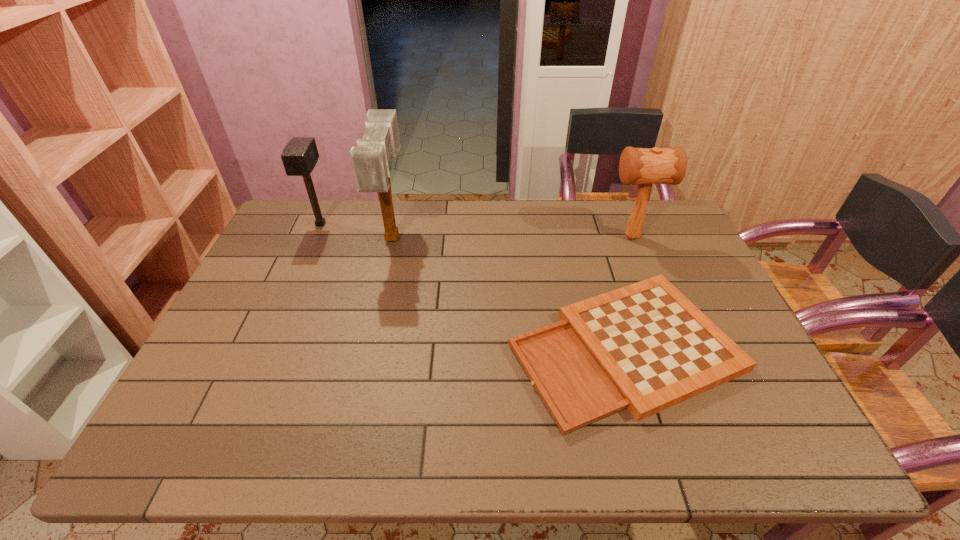
This screenshot has width=960, height=540. Identify the location of vacant area situated 0.320m on the right of the leftmost object. (423, 224).

Locate an element on the screen. free region located on the back of the nearest object is located at coordinates (599, 267).

At what (x,y) coordinates should I click in order to perform the action: click on object present at the near edge. Please return your answer as a coordinate pair (x, y). This screenshot has height=540, width=960. Looking at the image, I should click on (646, 347).

The image size is (960, 540). Find the location of `object at the left edge`. object at the left edge is located at coordinates (300, 156).

I want to click on mallet that is at the right edge, so click(x=646, y=166).

You are a GUI agent. You are given a task and a screenshot of the screen. Output one action in this format:
    pyautogui.click(x=<x>, y=<y>)
    Task: Click on the gameboard located at the right edge
    Image resolution: width=960 pixels, height=540 pixels.
    Given the screenshot: What is the action you would take?
    pyautogui.click(x=646, y=347)

Find the location of `object located at the far left corner`. object located at the far left corner is located at coordinates (300, 156).

This screenshot has height=540, width=960. I want to click on object present at the far right corner, so click(x=646, y=166).

In order to click on object located at the near right corner in this screenshot , I will do `click(646, 347)`.

The width and height of the screenshot is (960, 540). Find the location of `vacant space at the far edge of the desktop`. vacant space at the far edge of the desktop is located at coordinates (411, 228).